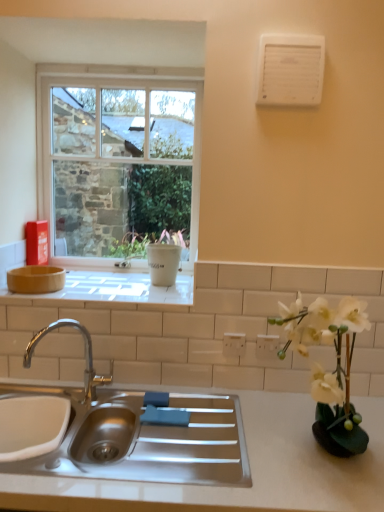
Question: Is white matte countertop at center in front of or behind white matte vase at right in the image?

Choices:
 (A) front
 (B) behind

Answer: (B)

Question: Is white matte countertop at center to the left or to the right of white matte vase at right in the image?

Choices:
 (A) left
 (B) right

Answer: (A)

Question: Which is farther from the clear glass window at upper left?

Choices:
 (A) stainless steel sink at center
 (B) white plastic electric outlet at upper center, the 2th electric outlet when ordered from left to right
 (C) white matte vase at right
 (D) white plastic electric outlet at center, which is the first electric outlet from left to right
 (E) white plastic air conditioner at upper right

Answer: (C)

Question: Which of these objects is positioned farthest from the stainless steel sink at center?

Choices:
 (A) white matte countertop at center
 (B) white matte vase at right
 (C) clear glass window at upper left
 (D) white plastic electric outlet at upper center, the 1th electric outlet in the right-to-left sequence
 (E) white plastic air conditioner at upper right

Answer: (E)